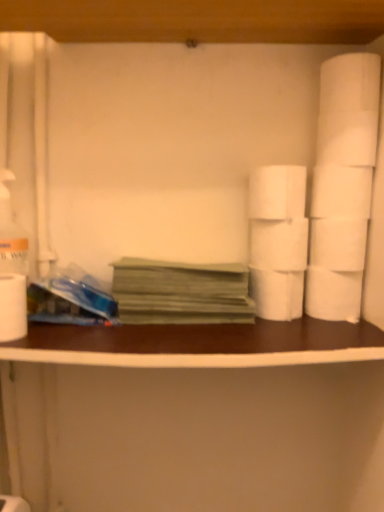
Identify the location of free space to the right of white matte toilet paper at left, the first toilet paper viewed from the left. The height and width of the screenshot is (512, 384). (94, 335).